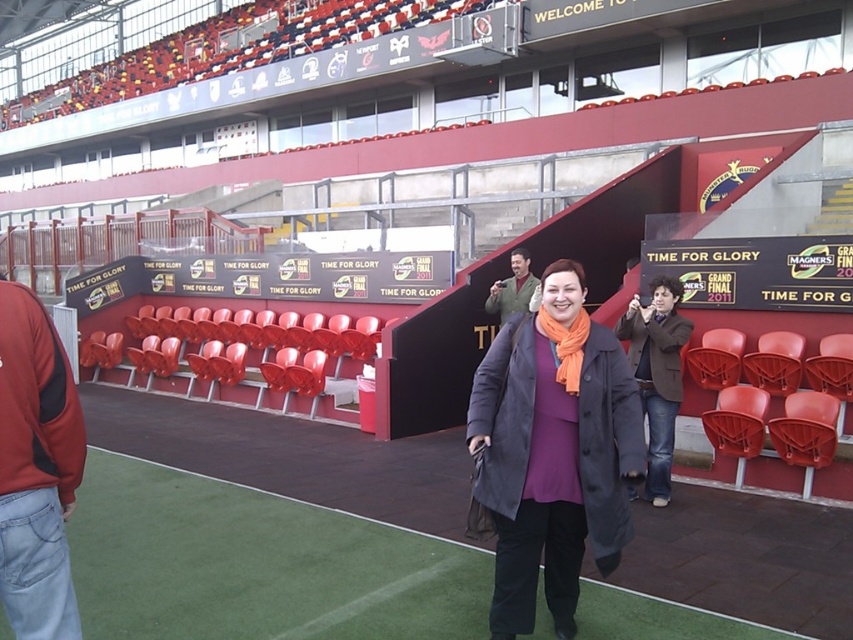
Question: Which point appears farthest from the camera in this image?

Choices:
 (A) (570, 339)
 (B) (641, 332)
 (C) (502, 292)
 (D) (492, 372)

Answer: (C)

Question: Considering the relative positions of brown leather jacket at center and green fuzzy jacket at center in the image provided, where is brown leather jacket at center located with respect to green fuzzy jacket at center?

Choices:
 (A) left
 (B) right

Answer: (B)

Question: Does matte purple sweater at center appear on the left side of orange fabric scarf at center?

Choices:
 (A) yes
 (B) no

Answer: (A)

Question: Which point appears closest to the camera in this image?

Choices:
 (A) (672, 417)
 (B) (572, 340)
 (C) (489, 300)

Answer: (B)

Question: Which point is farther to the camera?

Choices:
 (A) coord(515,282)
 (B) coord(640,440)
 (C) coord(656,339)

Answer: (A)

Question: Is orange fabric scarf at center positioned in front of green fuzzy jacket at center?

Choices:
 (A) no
 (B) yes

Answer: (B)